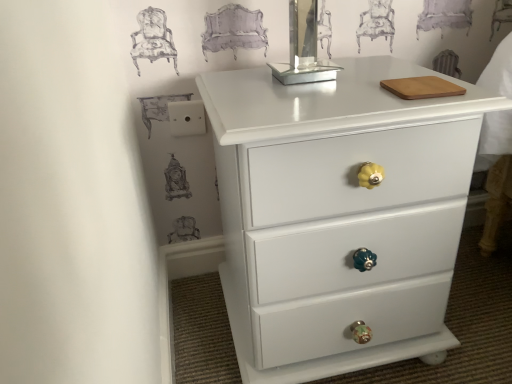
Identify the location of white glossy chest of drawers at center. This screenshot has height=384, width=512. (339, 215).

What do you see at coordinates (339, 215) in the screenshot?
I see `white glossy chest of drawers at center` at bounding box center [339, 215].

Where is `white glossy chest of drawers at center`? white glossy chest of drawers at center is located at coordinates (339, 215).